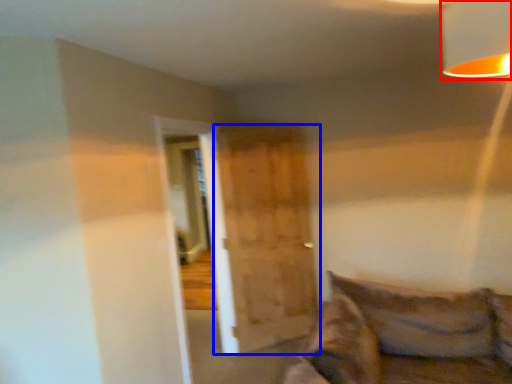
Question: Which object appears farthest to the camera in this image, lamp (highlighted by a red box) or barn door (highlighted by a blue box)?

Choices:
 (A) lamp
 (B) barn door

Answer: (B)